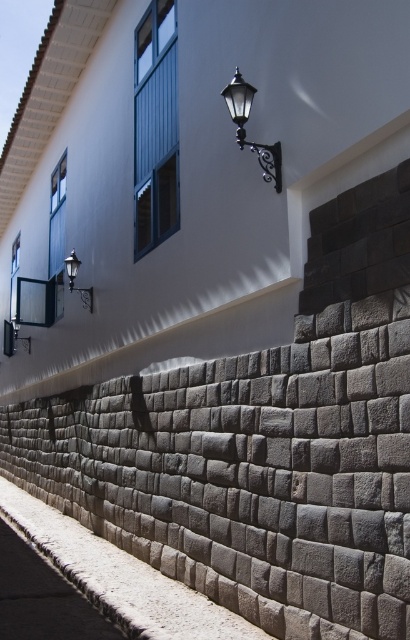
Can you confirm if gray stone pavement at lower left is positioned to the left of matte black lamp at upper left?

In fact, gray stone pavement at lower left is to the right of matte black lamp at upper left.

Which is below, gray stone pavement at lower left or matte black lamp at upper left?

gray stone pavement at lower left is lower down.

Between point (104, 637) and point (88, 308), which one is positioned in front?

Positioned in front is point (104, 637).

The image size is (410, 640). Identify the location of gray stone pavement at lower left. (41, 598).

Based on the photo, between polished brass lantern at upper center and matte black wall sconce at upper left, which one has more height?

polished brass lantern at upper center

Is polished brass lantern at upper center below matte black wall sconce at upper left?

Actually, polished brass lantern at upper center is above matte black wall sconce at upper left.

Does point (236, 120) lie behind point (4, 332)?

No, (236, 120) is in front of (4, 332).

In order to click on polished brass lantern at upper center in this screenshot , I will do coord(245,129).

Which is in front, point (4, 589) or point (236, 68)?

Point (236, 68) is in front.

Which is above, gray stone pavement at lower left or polished brass lantern at upper center?

Result: polished brass lantern at upper center is above.

This screenshot has width=410, height=640. In order to click on gray stone pavement at lower left in this screenshot , I will do `click(41, 598)`.

Locate an element on the screen. This screenshot has width=410, height=640. gray stone pavement at lower left is located at coordinates (41, 598).